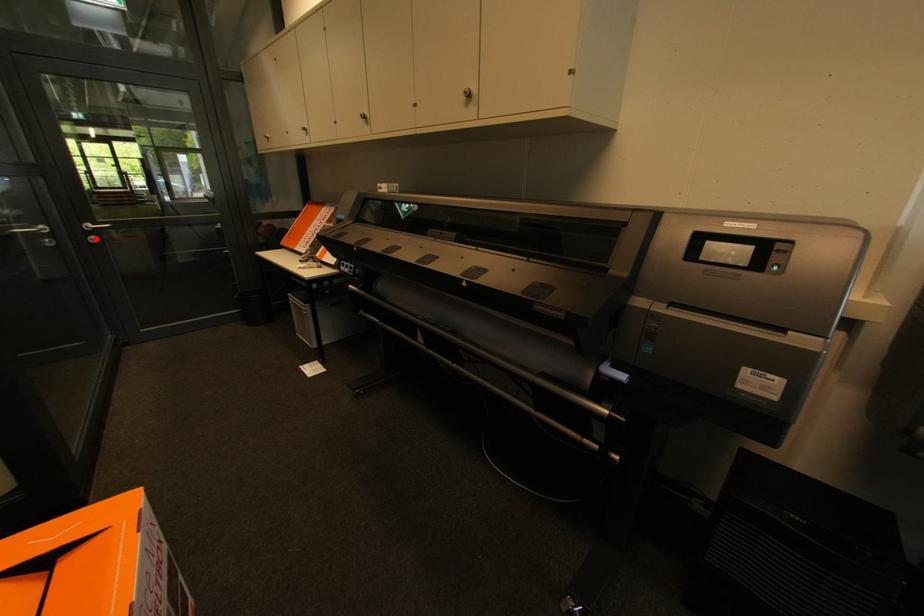
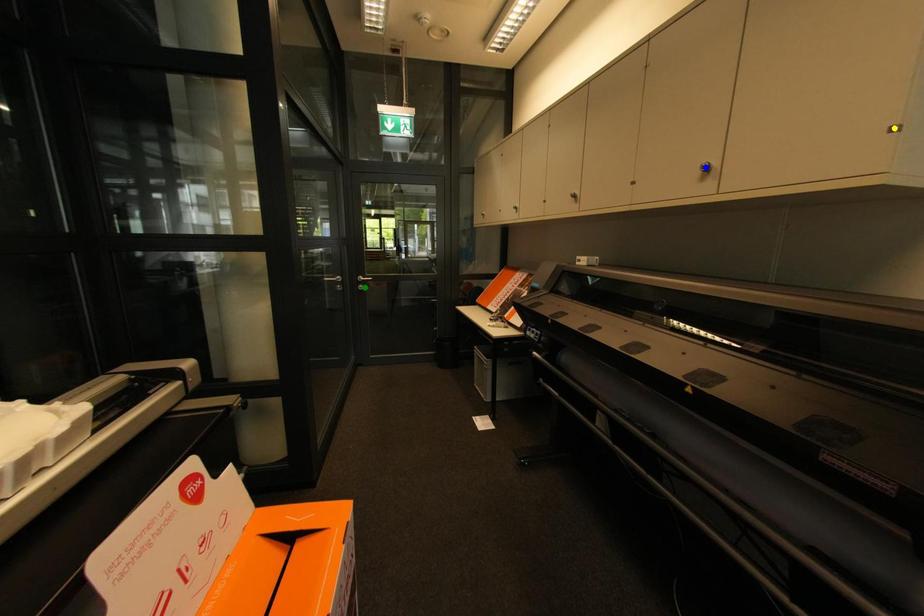
Question: I am providing you with two images of the same scene from different viewpoints. A red point is marked on the first image. You are given multiple points on the second image. Which point in image 2 is actually the same real-world point as the red point in image 1?

Choices:
 (A) yellow point
 (B) blue point
 (C) green point

Answer: (C)